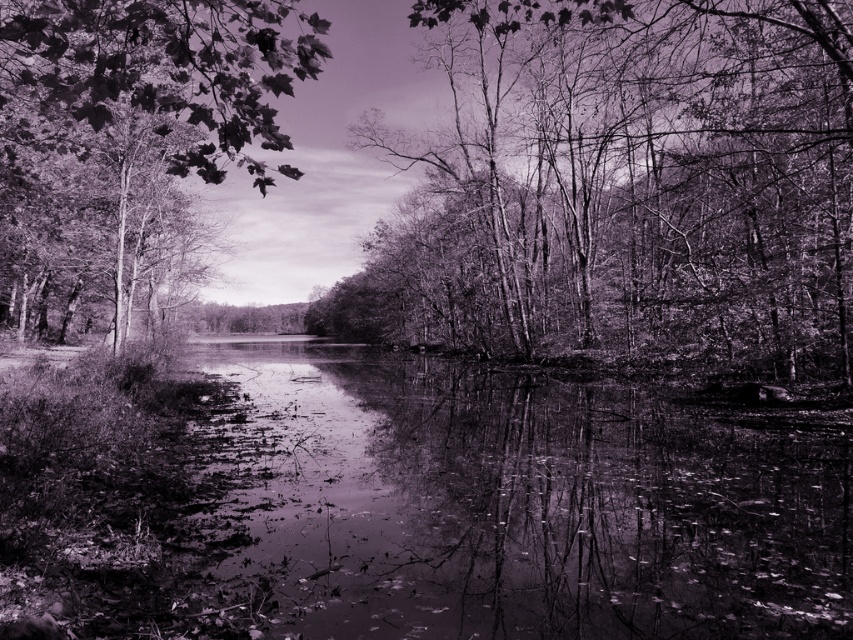
Question: Does smooth bark trees at center have a smaller size compared to smooth bark tree at left?

Choices:
 (A) yes
 (B) no

Answer: (B)

Question: Among these points, which one is farthest from the camera?

Choices:
 (A) (173, 8)
 (B) (457, 177)

Answer: (B)

Question: Is smooth bark trees at center to the right of smooth bark tree at left from the viewer's perspective?

Choices:
 (A) no
 (B) yes

Answer: (B)

Question: Among these points, which one is farthest from the camera?

Choices:
 (A) (234, 13)
 (B) (361, 275)

Answer: (B)

Question: Can you confirm if smooth bark trees at center is wider than smooth bark tree at left?

Choices:
 (A) no
 (B) yes

Answer: (B)

Question: Which point is farther to the camera?

Choices:
 (A) smooth bark tree at left
 (B) smooth bark trees at center

Answer: (B)